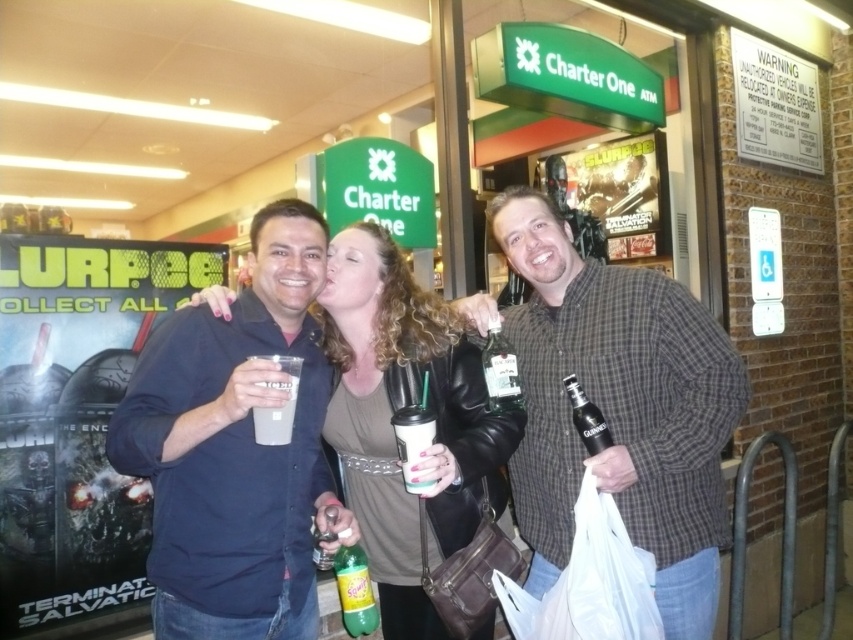
Question: Which point is farther from the camera taking this photo?

Choices:
 (A) (340, 572)
 (B) (573, 406)
 (C) (318, 440)
 (D) (511, 620)

Answer: (C)

Question: Can you confirm if checkered fabric shirt at center is bigger than white matte cup at center?

Choices:
 (A) no
 (B) yes

Answer: (B)

Question: Which point is closer to the camera?

Choices:
 (A) black glass bottle at center-right
 (B) green matte soda bottle at center
 (C) dark blue shirt at center

Answer: (C)

Question: Can you confirm if dark blue shirt at center is bigger than white matte cup at center?

Choices:
 (A) no
 (B) yes

Answer: (B)

Question: Does checkered fabric shirt at center appear over clear glass bottle at center?

Choices:
 (A) no
 (B) yes

Answer: (A)

Question: Which object is farther from the camera taking this photo?

Choices:
 (A) clear glass bottle at center
 (B) white plastic bag at lower right
 (C) matte black jacket at center
 (D) green matte soda bottle at center

Answer: (A)